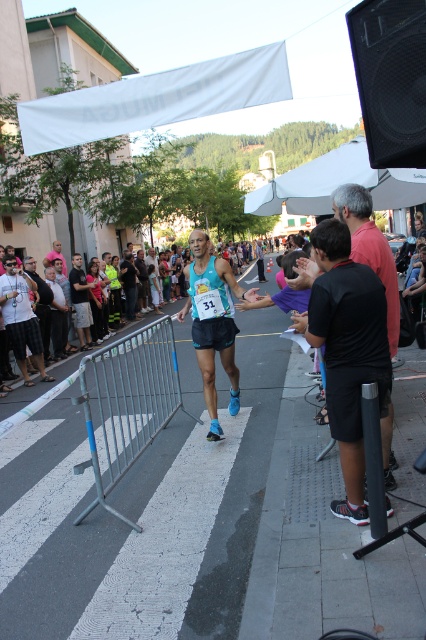
Does black matte shorts at right have a greater width compared to matte blue tank top at center?

In fact, black matte shorts at right might be narrower than matte blue tank top at center.

Does black matte shorts at right appear on the left side of matte blue tank top at center?

Incorrect, black matte shorts at right is not on the left side of matte blue tank top at center.

Does point (345, 385) lie in front of point (94, 312)?

Yes, it is.

Locate an element on the screen. black matte shorts at right is located at coordinates (348, 352).

Measure the distance between black matte shorts at right and camera.

10.49 feet

Is black matte shorts at right bigger than silver metallic rail at center?

No, black matte shorts at right is not bigger than silver metallic rail at center.

Consider the image. Who is more forward, (336, 316) or (92, 436)?

Point (336, 316)

Find the location of a particular element. This screenshot has height=640, width=426. black matte shorts at right is located at coordinates (348, 352).

You are a GUI agent. You are given a task and a screenshot of the screen. Output one action in this format:
    pyautogui.click(x=<x>, y=<y>)
    Task: Click on the silver metallic rail at center
    This screenshot has height=640, width=426.
    Given the screenshot: What is the action you would take?
    pyautogui.click(x=129, y=401)

Is silver metallic rail at center behind matte blue tank top at center?

That is False.

Who is more forward, (100, 426) or (97, 307)?

Point (100, 426) is in front.

This screenshot has width=426, height=640. I want to click on silver metallic rail at center, so click(x=129, y=401).